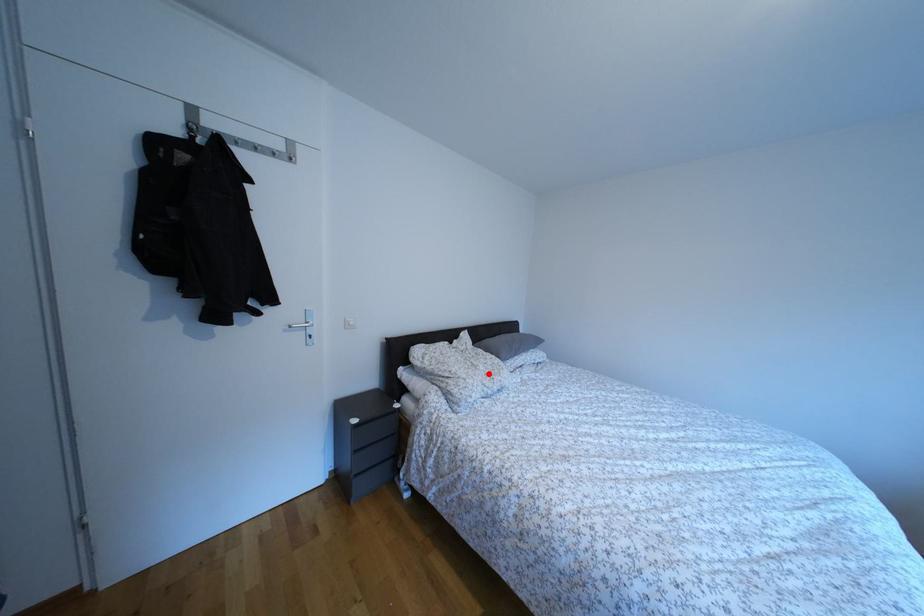
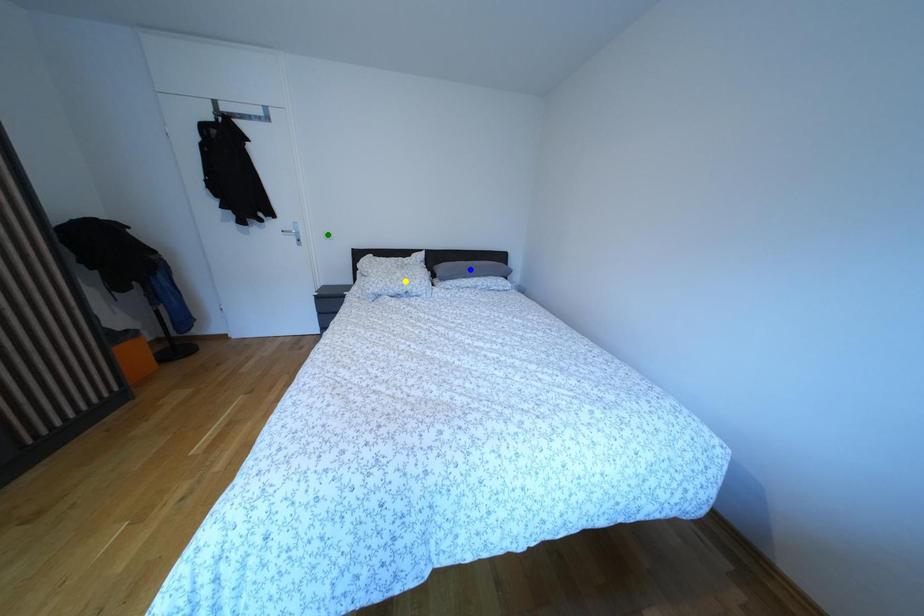
Question: I am providing you with two images of the same scene from different viewpoints. A red point is marked on the first image. You are given multiple points on the second image. Which mark in image 2 goes with the point in image 1?

Choices:
 (A) blue point
 (B) yellow point
 (C) green point

Answer: (B)